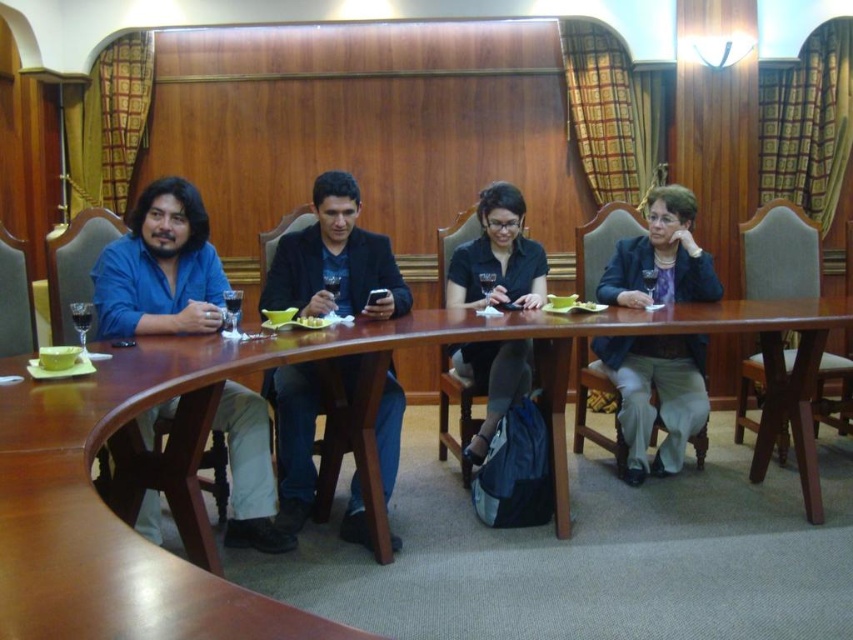
What do you see at coordinates (351, 448) in the screenshot?
I see `brown wood table at center` at bounding box center [351, 448].

Measure the distance between point (171, 608) and camera.

34.24 inches

The width and height of the screenshot is (853, 640). Identify the location of brown wood table at center. (351, 448).

Does blue cotton shirt at left have a lesser width compared to matte blue blazer at right?

Yes, blue cotton shirt at left is thinner than matte blue blazer at right.

Is blue cotton shirt at left shorter than matte blue blazer at right?

Yes, blue cotton shirt at left is shorter than matte blue blazer at right.

The width and height of the screenshot is (853, 640). What do you see at coordinates (160, 268) in the screenshot?
I see `blue cotton shirt at left` at bounding box center [160, 268].

This screenshot has width=853, height=640. Identify the location of blue cotton shirt at left. (160, 268).

From the picture: Between brown wood table at center and blue cotton shirt at left, which one appears on the right side from the viewer's perspective?

From the viewer's perspective, brown wood table at center appears more on the right side.

Identify the location of brown wood table at center. This screenshot has width=853, height=640. (351, 448).

The height and width of the screenshot is (640, 853). Identify the location of brown wood table at center. (351, 448).